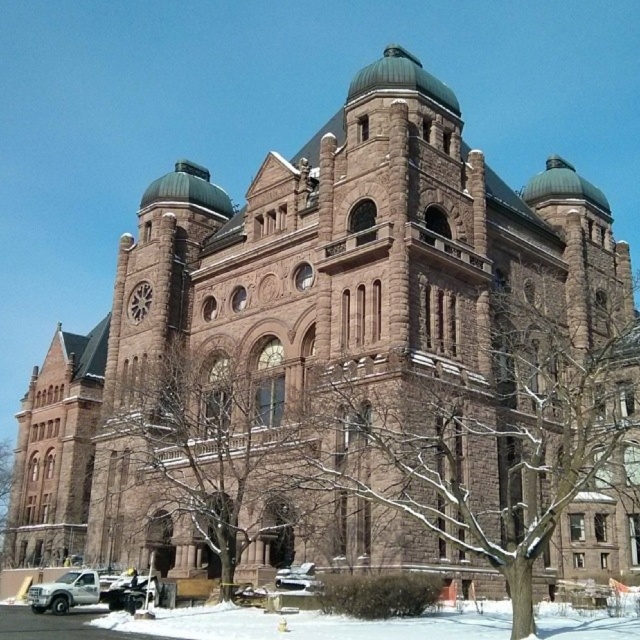
Between silver metallic truck at lower left and silver metallic car at lower center, which one has more height?

With more height is silver metallic truck at lower left.

Between silver metallic truck at lower left and silver metallic car at lower center, which one appears on the left side from the viewer's perspective?

silver metallic truck at lower left

Is point (49, 608) positioned before point (289, 579)?

Yes, it is in front of point (289, 579).

Find the location of a particular element. Image resolution: width=640 pixels, height=640 pixels. silver metallic truck at lower left is located at coordinates (65, 592).

Locate an element on the screen. The image size is (640, 640). white powdery snow at lower center is located at coordinates (316, 625).

Can you confirm if white powdery snow at lower center is smaller than silver metallic car at lower center?

Actually, white powdery snow at lower center might be larger than silver metallic car at lower center.

Identify the location of white powdery snow at lower center. (316, 625).

The width and height of the screenshot is (640, 640). I want to click on white powdery snow at lower center, so click(316, 625).

Who is more distant from viewer, [468,634] or [92,589]?

Positioned behind is point [92,589].

Is white powdery snow at lower center positioned before silver metallic truck at lower left?

Yes, it is.

Describe the element at coordinates (316, 625) in the screenshot. I see `white powdery snow at lower center` at that location.

Locate an element on the screen. white powdery snow at lower center is located at coordinates (316, 625).